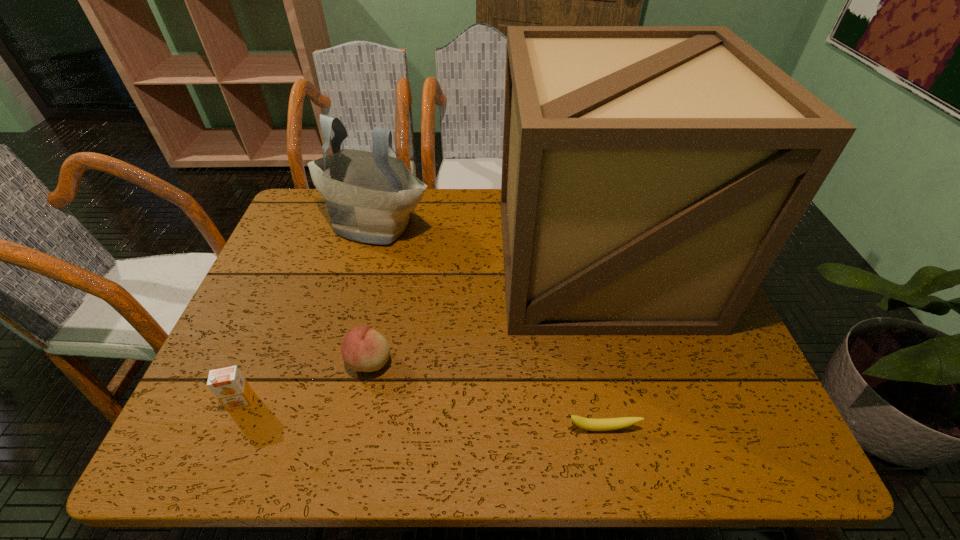
The image size is (960, 540). I want to click on the tallest object, so click(x=651, y=175).

You are a GUI agent. You are given a task and a screenshot of the screen. Output one action in this format:
    pyautogui.click(x=<x>, y=<y>)
    Task: Click on the shopping bag
    The image size is (960, 540).
    Given the screenshot: What is the action you would take?
    point(369,195)

Where is `orange juice`? orange juice is located at coordinates (228, 384).

The image size is (960, 540). Find the location of `peach`. peach is located at coordinates (363, 349).

The height and width of the screenshot is (540, 960). What are the coordinates of `the shortest object` in the screenshot? It's located at (607, 424).

You are a GUI agent. You are given a task and a screenshot of the screen. Output one action in this format:
    pyautogui.click(x=<x>, y=<y>)
    Task: Click on the banana
    
    Given the screenshot: What is the action you would take?
    pyautogui.click(x=607, y=424)

Find the location of a particular element. vacant space located 0.280m on the reinforced sides of the box is located at coordinates click(x=652, y=457).

Locate an element on the screen. free spot located on the front of the shopping bag is located at coordinates (341, 354).

This screenshot has width=960, height=540. I want to click on vacant space situated on the right of the orange juice, so click(438, 401).

Find the location of `vacant space situated on the left of the peach`. vacant space situated on the left of the peach is located at coordinates (245, 361).